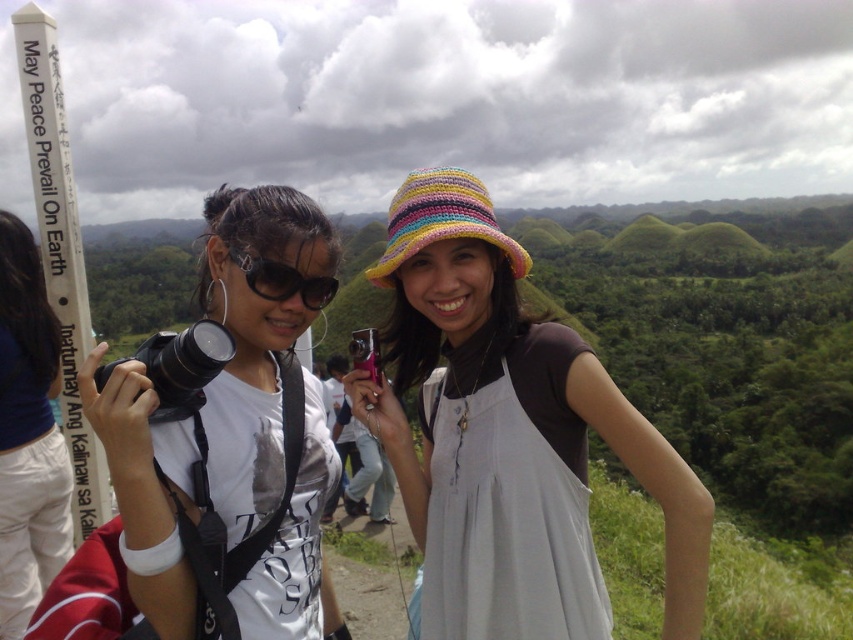
Question: Which point appears closest to the camera in this image?

Choices:
 (A) (457, 180)
 (B) (370, 339)
 (C) (463, 396)
 (D) (270, 300)

Answer: (D)

Question: Which object is closer to the camera taking this photo?

Choices:
 (A) multicolored knitted hat at center
 (B) black plastic camera at center

Answer: (A)

Question: Observing the image, what is the correct spatial positioning of matte black camera at left in reference to matte black sunglasses at center?

Choices:
 (A) above
 (B) below

Answer: (B)

Question: Can you confirm if matte black sunglasses at center is positioned to the right of black plastic camera at center?

Choices:
 (A) no
 (B) yes

Answer: (B)

Question: Observing the image, what is the correct spatial positioning of matte black camera at left in reference to black plastic camera at center?

Choices:
 (A) below
 (B) above

Answer: (B)

Question: Estimate the real-world distances between objects in this image. Which object is closer to the matte black camera at left?

Choices:
 (A) white fabric shirt at center
 (B) multicolored knitted hat at center

Answer: (A)